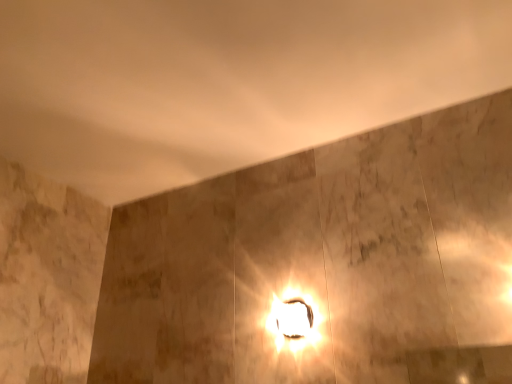
Describe the element at coordinates (294, 319) in the screenshot. I see `matte white lamp at center` at that location.

Find the location of a particular element. matte white lamp at center is located at coordinates (294, 319).

At what (x,y) coordinates should I click in order to perform the action: click on matte white lamp at center. Please return your answer as a coordinate pair (x, y). Looking at the image, I should click on (294, 319).